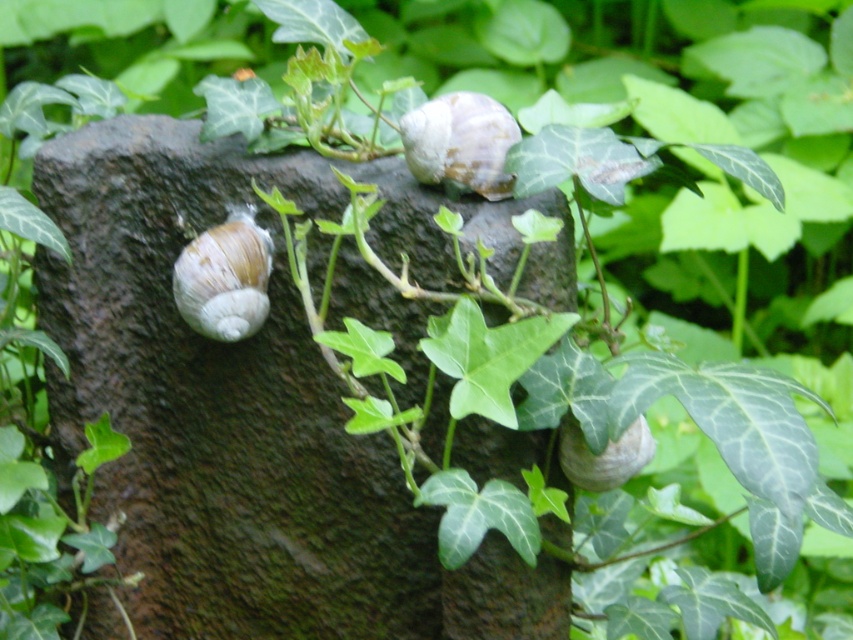
Question: Among these points, which one is farthest from the camera?

Choices:
 (A) pos(460,180)
 (B) pos(570,428)

Answer: (A)

Question: Can you confirm if matte brown shell at left is positioned above white matte snail at upper center?

Choices:
 (A) no
 (B) yes

Answer: (A)

Question: Which of the following is the farthest from the observer?

Choices:
 (A) matte brown shell at left
 (B) shiny white shell at lower right

Answer: (A)

Question: Which of the following is the farthest from the observer?

Choices:
 (A) (480, 192)
 (B) (598, 472)

Answer: (A)

Question: In this image, where is white matte snail at upper center located relative to shiny white shell at lower right?

Choices:
 (A) right
 (B) left

Answer: (B)

Question: Is white matte snail at upper center to the right of shiny white shell at lower right from the viewer's perspective?

Choices:
 (A) yes
 (B) no

Answer: (B)